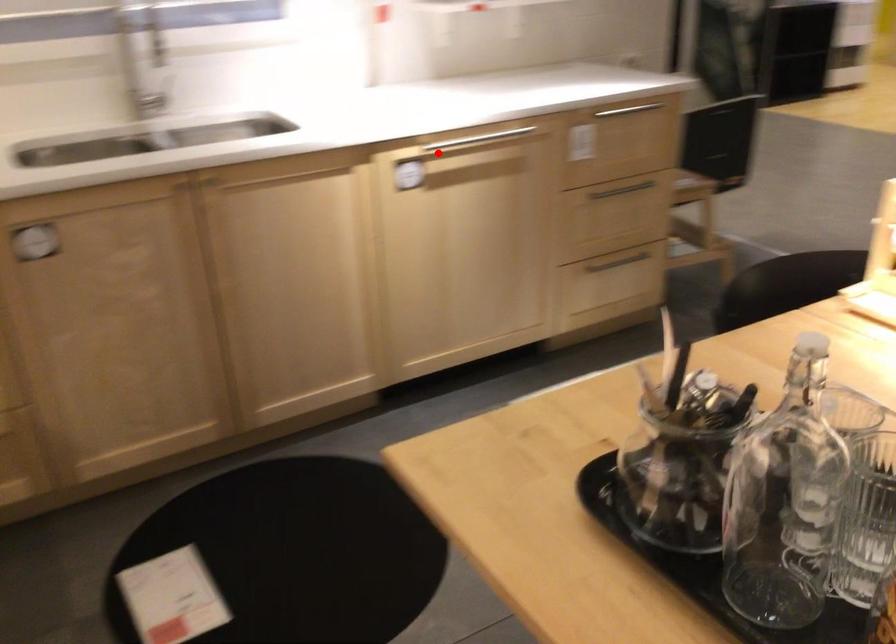
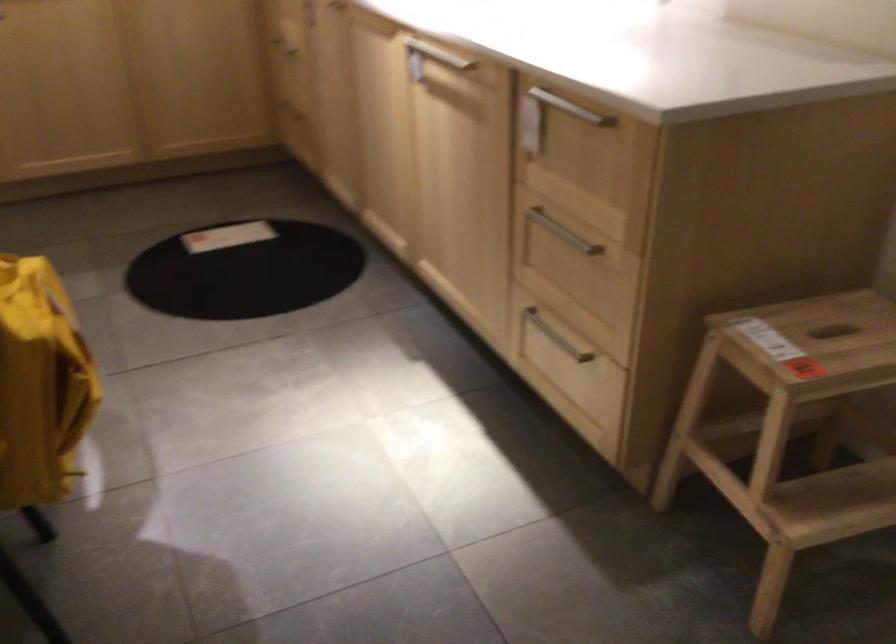
The point at the highlighted location is marked in the first image. Where is the corresponding point in the second image?

(428, 59)